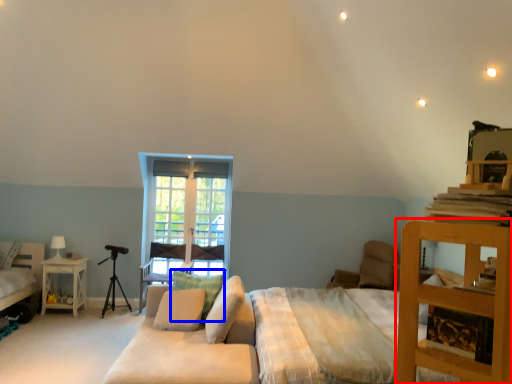
Question: Which object is closer to the camera taking this photo, computer desk (highlighted by a red box) or pillow (highlighted by a blue box)?

Choices:
 (A) computer desk
 (B) pillow

Answer: (A)